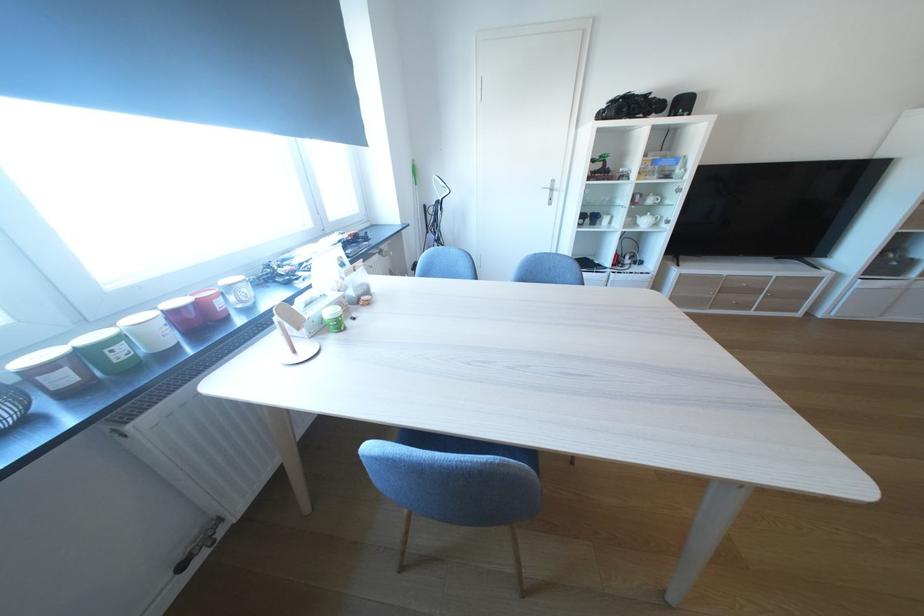
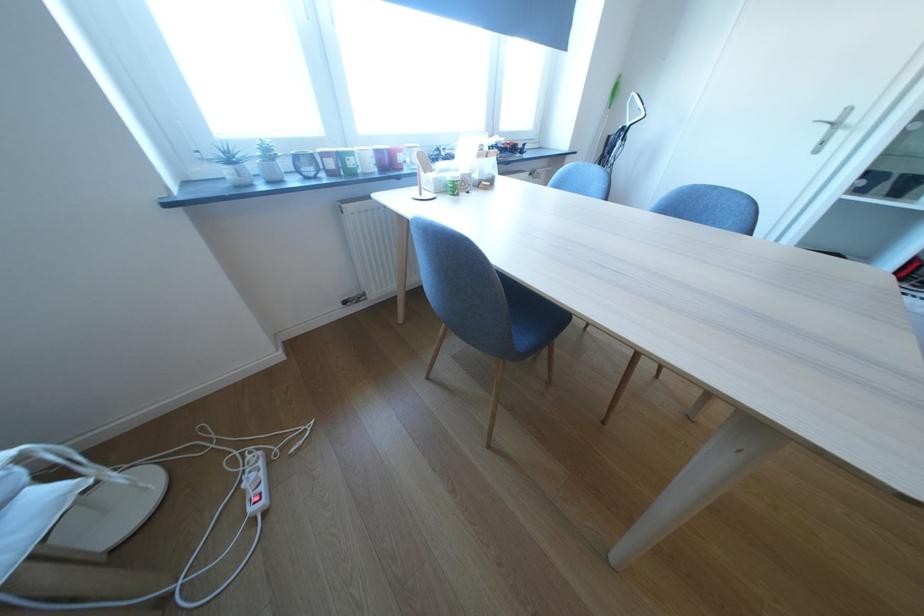
The point at (75,379) is marked in the first image. Where is the corresponding point in the second image?

(342, 164)